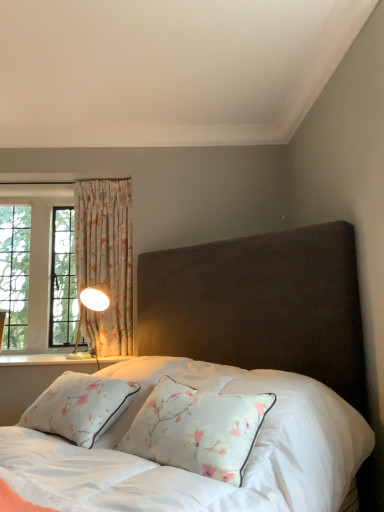
Question: Are metallic gold table lamp at left and floral fabric curtain at left far apart?

Choices:
 (A) no
 (B) yes

Answer: (A)

Question: From a real-world perspective, does metallic gold table lamp at left sit lower than floral fabric curtain at left?

Choices:
 (A) no
 (B) yes

Answer: (B)

Question: Is metallic gold table lamp at left at the left side of floral fabric curtain at left?

Choices:
 (A) no
 (B) yes

Answer: (B)

Question: Can we say metallic gold table lamp at left lies outside floral fabric curtain at left?

Choices:
 (A) yes
 (B) no

Answer: (B)

Question: Does metallic gold table lamp at left have a lesser height compared to floral fabric curtain at left?

Choices:
 (A) yes
 (B) no

Answer: (A)

Question: From a real-world perspective, is metallic gold table lamp at left physically above floral fabric curtain at left?

Choices:
 (A) yes
 (B) no

Answer: (B)

Question: Considering the relative sizes of floral fabric curtain at left and metallic gold table lamp at left in the image provided, is floral fabric curtain at left smaller than metallic gold table lamp at left?

Choices:
 (A) no
 (B) yes

Answer: (A)

Question: Does floral fabric curtain at left appear on the right side of metallic gold table lamp at left?

Choices:
 (A) no
 (B) yes

Answer: (B)

Question: Is the depth of floral fabric curtain at left less than that of metallic gold table lamp at left?

Choices:
 (A) yes
 (B) no

Answer: (B)

Question: Can you confirm if floral fabric curtain at left is shorter than metallic gold table lamp at left?

Choices:
 (A) yes
 (B) no

Answer: (B)

Question: Is floral fabric curtain at left looking in the opposite direction of metallic gold table lamp at left?

Choices:
 (A) no
 (B) yes

Answer: (B)

Question: Does floral fabric curtain at left have a larger size compared to metallic gold table lamp at left?

Choices:
 (A) no
 (B) yes

Answer: (B)

Question: Is velvet dark brown bed at center in front of metallic gold table lamp at left?

Choices:
 (A) yes
 (B) no

Answer: (A)